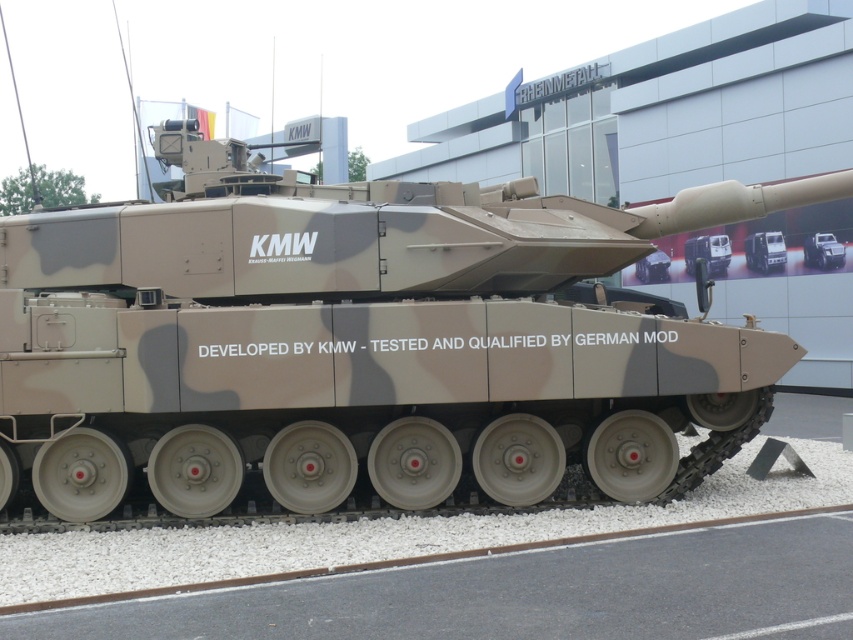
Question: Does camouflage matte tank at center appear over camouflage textured tank at center?

Choices:
 (A) no
 (B) yes

Answer: (B)

Question: Which object appears farthest from the camera in this image?

Choices:
 (A) camouflage textured tank at center
 (B) camouflage matte tank at center

Answer: (B)

Question: Does camouflage matte tank at center have a greater width compared to camouflage textured tank at center?

Choices:
 (A) yes
 (B) no

Answer: (A)

Question: Is camouflage matte tank at center above camouflage textured tank at center?

Choices:
 (A) yes
 (B) no

Answer: (A)

Question: Which point is closer to the camera?

Choices:
 (A) camouflage textured tank at center
 (B) camouflage matte tank at center

Answer: (A)